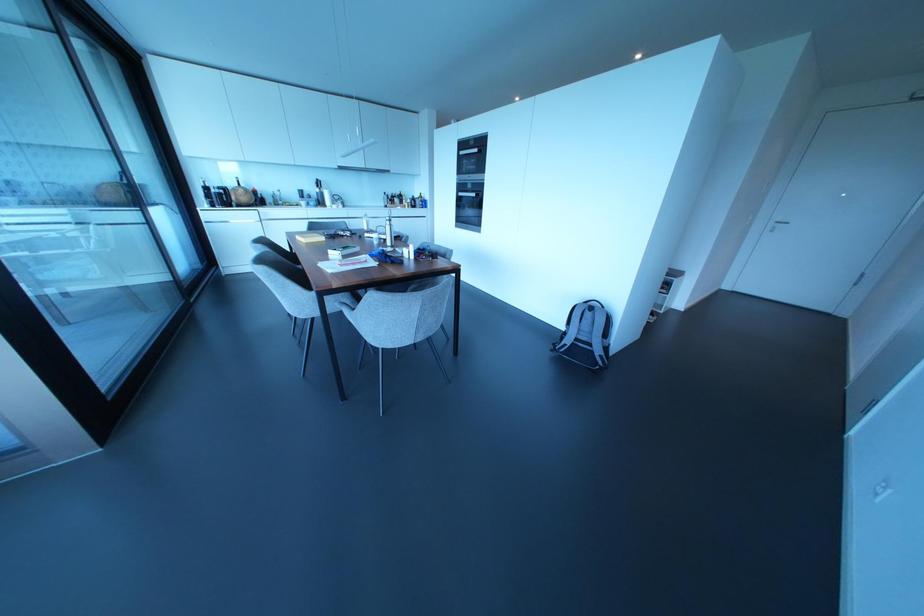
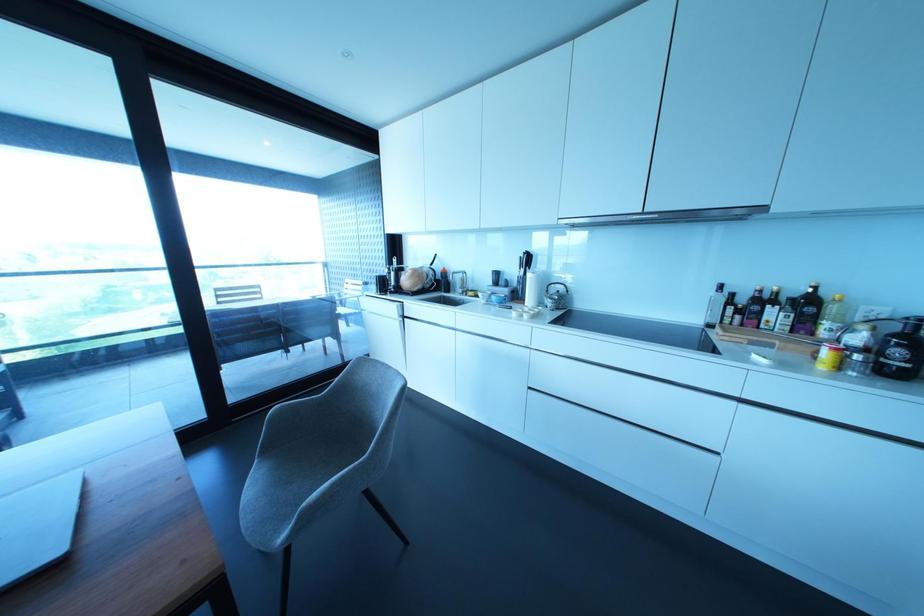
Locate, in the second image, the point that corresponds to point 318,183 in the first image.

(527, 259)